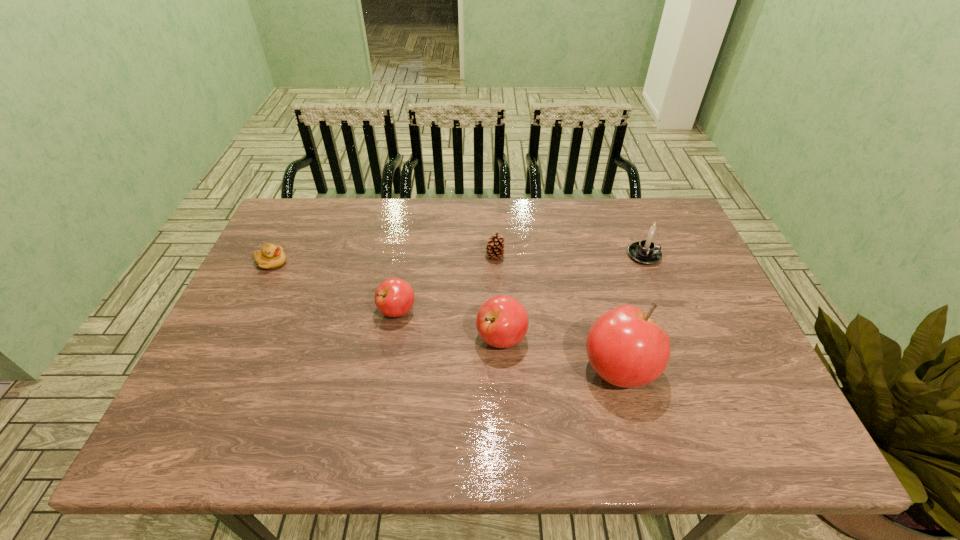
The apples are evenly distributed in the image. To maintain this, where would you place another apple on the right? Please point to a free space. Please provide its 2D coordinates. Your answer should be formatted as a tuple, i.e. [(x, y)], where the tuple contains the x and y coordinates of a point satisfying the conditions above.

[(751, 404)]